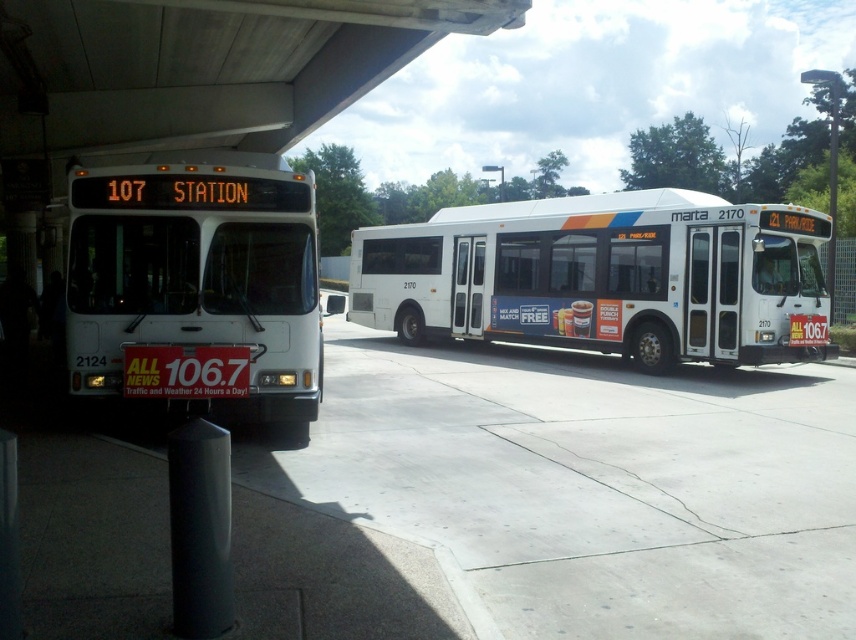
Can you confirm if white matte bus at center is positioned to the right of white matte bus at left?

Yes, white matte bus at center is to the right of white matte bus at left.

Does white matte bus at center lie in front of white matte bus at left?

No, it is not.

Consider the image. Who is more distant from viewer, [667,260] or [254,282]?

Positioned behind is point [667,260].

This screenshot has width=856, height=640. I want to click on white matte bus at center, so click(605, 276).